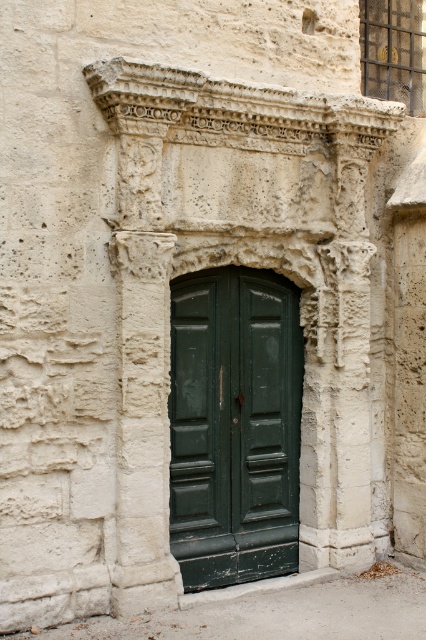
You are an architect designing a new building and want to ensure that the entranceway is visually balanced. Given the scene described, which object should be placed higher to maintain symmetry between the carved stone arch at center and the green wooden door at center?

The carved stone arch at center is taller than the green wooden door at center, so to maintain symmetry, the green wooden door at center should be placed higher to align its top edge with the height of the carved stone arch at center.

You are an architect examining the stone building. You notice a point marked at coordinates (238, 308). Based on the scene, what significant architectural feature does this point most likely indicate?

The point at (238, 308) marks the carved stone arch at center, which is the central feature of the doorway framed by intricate carvings and supported by columns.